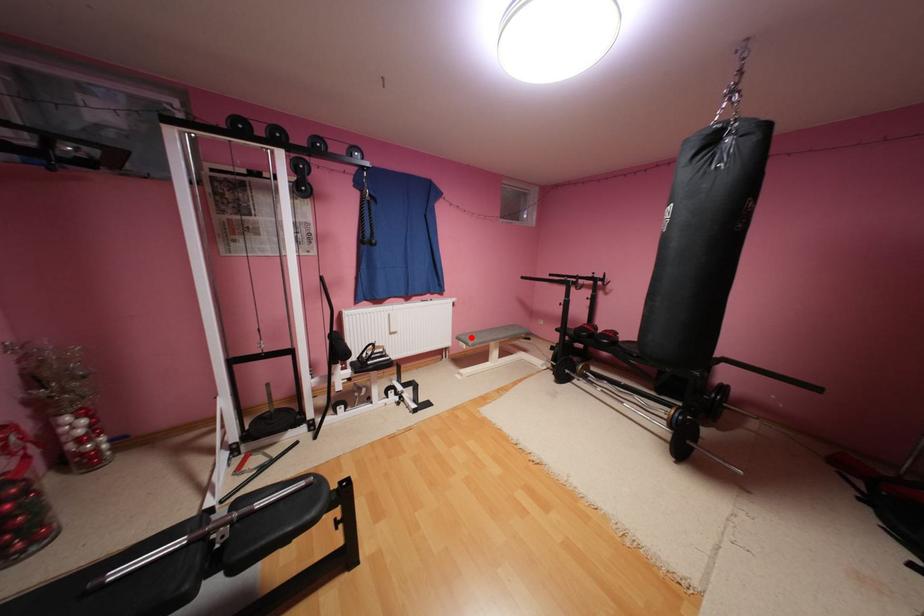
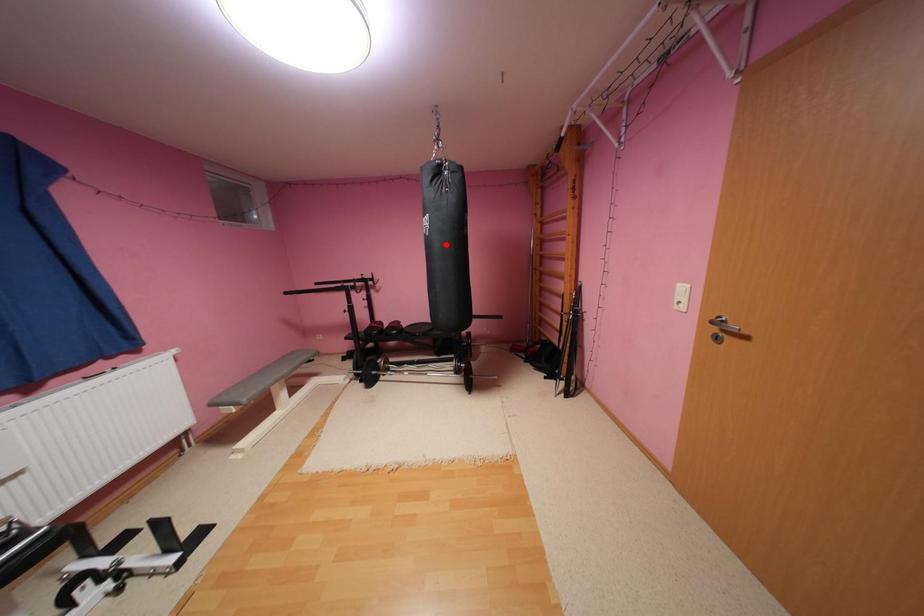
I am providing you with two images of the same scene from different viewpoints. A red point is marked on the first image and another point is marked on the second image. Is the marked point in image1 the same physical position as the marked point in image2?

No